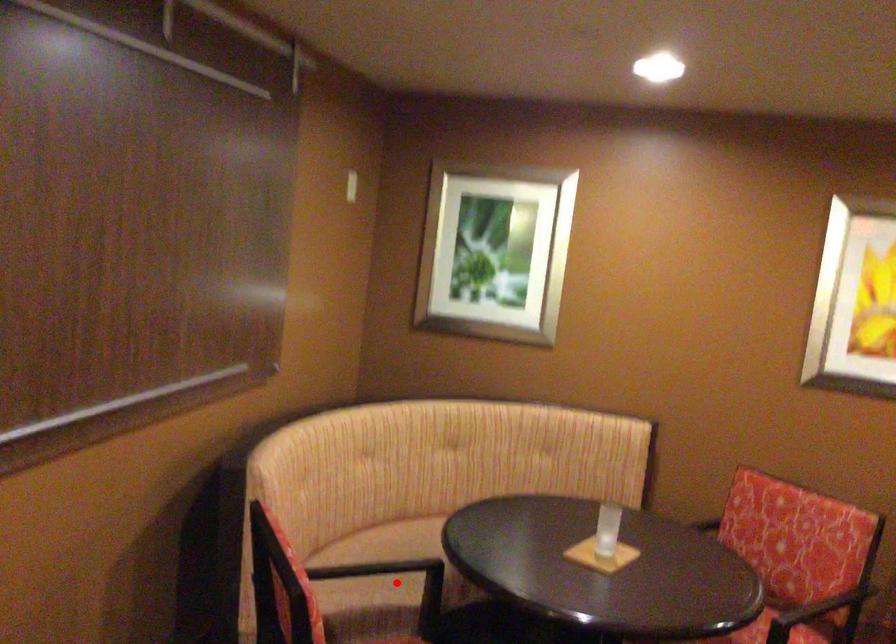
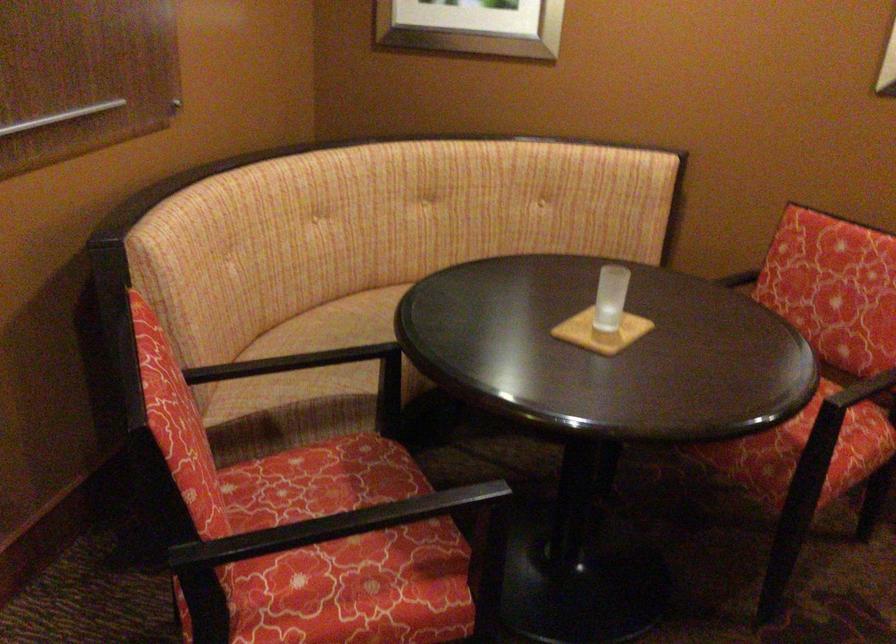
Question: A red point is marked in image1. In image2, is the corresponding 3D point closer to the camera or farther? Reply with the corresponding letter.

Choices:
 (A) The corresponding 3D point is closer.
 (B) The corresponding 3D point is farther.

Answer: (A)